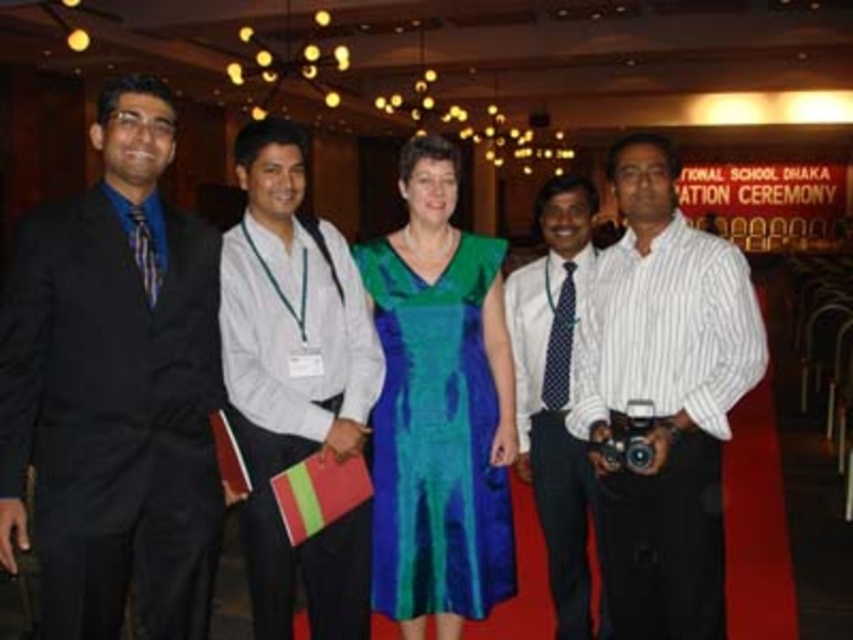
You are organizing a charity event and need to ensure that all participants have appropriately sized name tags. Given that the matte black suit at left has a larger size compared to the white cotton shirt at center, which participant should receive a larger name tag?

The matte black suit at left should receive a larger name tag since it has a larger size compared to the white cotton shirt at center.

You are a photographer adjusting the camera settings for a group photo. The subjects include the matte black suit at left and the shiny satin dress at center. To ensure both are properly illuminated, you need to know which subject is wider. Which one has a greater width?

The matte black suit at left has a greater width than the shiny satin dress at center.

From the picture: You are a photographer adjusting camera settings for the group photo. The camera has a focus range that can only accommodate objects up to 1.5 meters in height. Given the height relationship between the matte black suit at left and the shiny satin dress at center, will both subjects be in focus?

The matte black suit at left is not as tall as the shiny satin dress at center. Since the shiny satin dress at center is taller than 1.5 meters, the camera cannot focus on both subjects simultaneously.